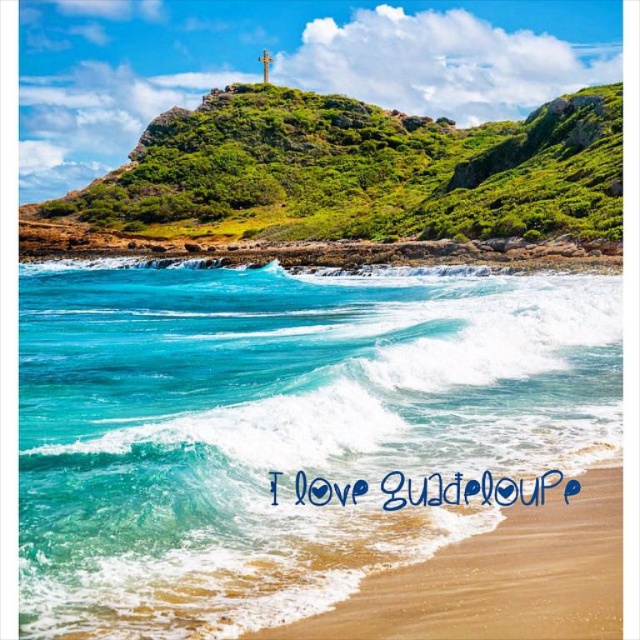
You are standing on the beach in this coastal scene and want to walk towards the rocky coastline. There are two points marked on your map as point 1 at coordinates point (70, 545) and point 2 at coordinates point (384, 620). Which point should you head towards to reach the rocky coastline first?

You should head towards point 2 at coordinates point (384, 620) because it is closer to the rocky coastline than point 1 at coordinates point (70, 545).

You are a drone operator tasked with capturing aerial footage of the coastal scene. The drone has a maximum flight range of 50 feet from its starting point. If you take off from the sandy beach at lower right, can you fly the drone to the turquoise glossy water at lower left without exceeding its range?

The distance between the turquoise glossy water at lower left and the sandy beach at lower right is 60.55 feet. Since the drone has a maximum flight range of 50 feet, it cannot reach the turquoise glossy water at lower left without exceeding its range.